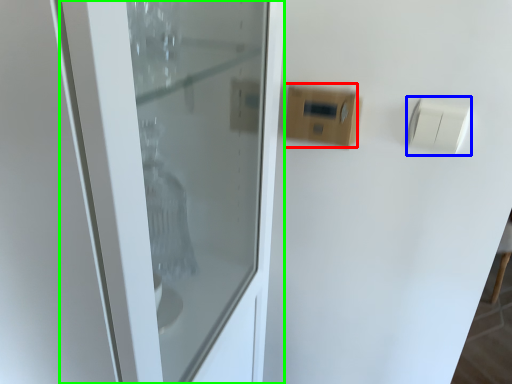
Question: Which object is the closest to the light switch (highlighted by a red box)? Choose among these: light switch (highlighted by a blue box) or door (highlighted by a green box).

Choices:
 (A) light switch
 (B) door

Answer: (A)